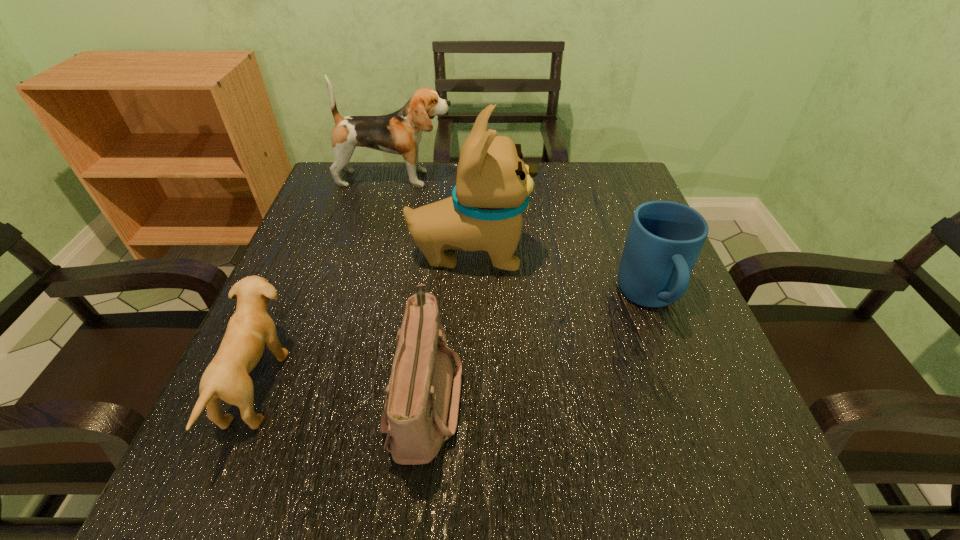
The width and height of the screenshot is (960, 540). I want to click on vacant space at the right edge of the desktop, so click(x=630, y=374).

The width and height of the screenshot is (960, 540). What are the coordinates of `free space at the near left corner` in the screenshot? It's located at (190, 466).

Identify the location of vacant space at the far right corner of the desktop. (597, 195).

This screenshot has height=540, width=960. I want to click on free spot at the near right corner of the desktop, so click(743, 463).

The height and width of the screenshot is (540, 960). What are the coordinates of `vacant area that lies between the mug and the second farthest puppy` in the screenshot? It's located at (560, 276).

The image size is (960, 540). Identify the location of empty space between the nearest puppy and the shoulder bag. (341, 392).

Identify the location of free space that is in between the shoulder bag and the nearest puppy. (341, 392).

I want to click on vacant space that's between the nearest puppy and the rightmost object, so click(454, 342).

Find the location of a particular element. This screenshot has height=540, width=960. vacant area that lies between the rightmost object and the second nearest puppy is located at coordinates (560, 276).

Where is `free area in between the shoulder bag and the shortest puppy`? free area in between the shoulder bag and the shortest puppy is located at coordinates (341, 392).